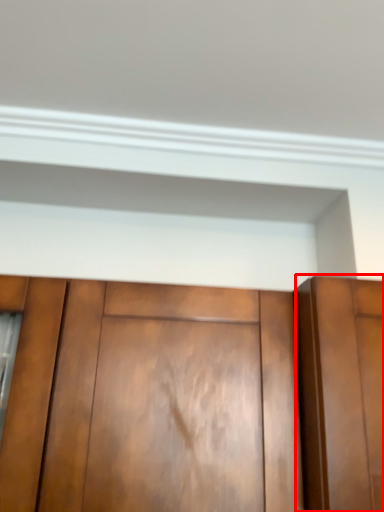
Question: From the image, what is the correct spatial relationship of door (annotated by the red box) in relation to cupboard?

Choices:
 (A) right
 (B) left

Answer: (A)